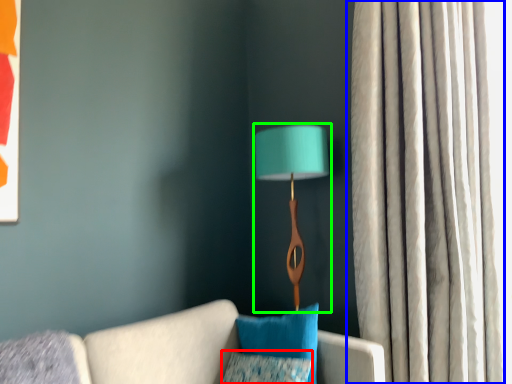
Question: Estimate the real-world distances between objects in this image. Which object is farther from pillow (highlighted by a red box), curtain (highlighted by a blue box) or lamp (highlighted by a green box)?

Choices:
 (A) curtain
 (B) lamp

Answer: (A)